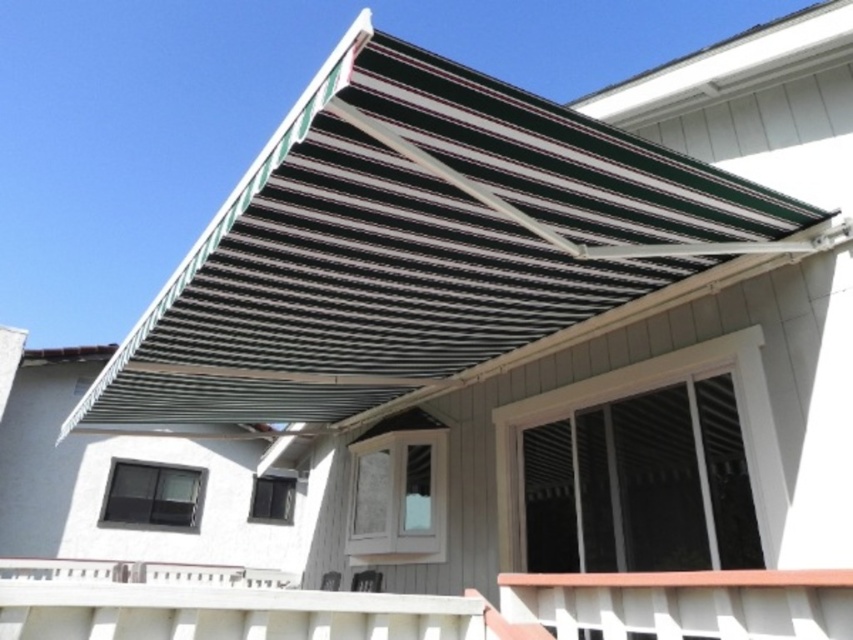
You are standing on the white wooden porch at lower center and want to reach the white plastic balustrade at lower right. Which direction should you move to get there?

You should move upward to reach the white plastic balustrade at lower right from the white wooden porch at lower center since the white wooden porch at lower center is located below the white plastic balustrade at lower right.

You are standing on the patio looking towards the house. Which object is positioned to the left when comparing the black striped awning at upper center and the white plastic balustrade at lower right?

The black striped awning at upper center is positioned to the left of the white plastic balustrade at lower right.

You are standing on the patio and want to check the size of the balustrades. Which one is smaller between the white plastic balustrade at lower right and the white plastic balustrade at lower center?

The white plastic balustrade at lower right is smaller than the white plastic balustrade at lower center.